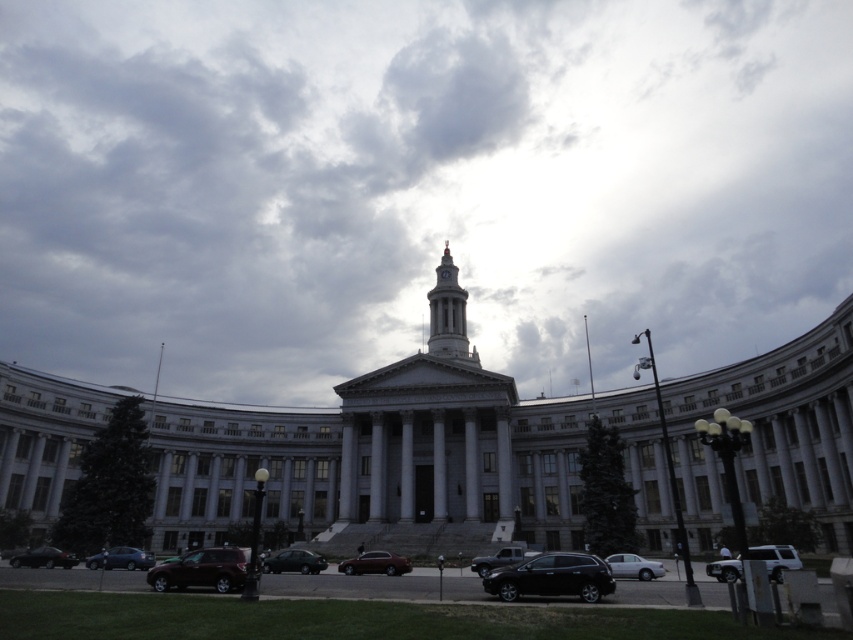
You are standing at point [740,563] and want to walk to the entrance of the grand neoclassical building. Is point [454,307] located between you and the entrance?

Point [454,307] is behind point [740,563], so it is not between you and the entrance. You can walk straight towards the entrance without passing through point [454,307].

You are a photographer planning to take a picture of the grand neoclassical building. You notice the cloudy sky at upper center and the matte black sedan at lower left in your frame. Based on their positions, which object appears larger in the photo?

The cloudy sky at upper center appears larger in the photo because it is taller than the matte black sedan at lower left.

Please provide the coordinates of the white marble bell tower at center in the image. The coordinate system has the origin at the bottom left corner of the image, with x increasing to the right and y increasing upwards. The coordinates are normalized between 0 and 1.

The white marble bell tower at center is located at coordinates point (447, 310).